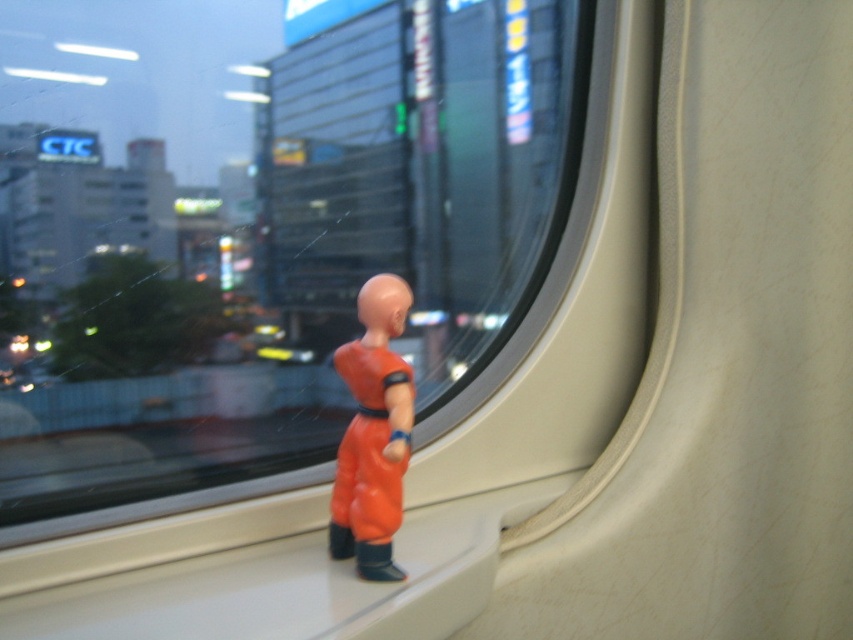
You are standing on the train and want to look through the window. Which of the two points, point (360, 96) or point (379, 577), is closer to your eyes?

Point (360, 96) is further to the viewer than point (379, 577), so the point closer to your eyes is point (379, 577).

You are a passenger on the train and you want to see the city lights outside through the transparent plastic train window at center. Can you see the orange matte figure at center blocking your view?

The transparent plastic train window at center is positioned over the orange matte figure at center, so the figure is blocking part of the window, making it harder to see the city lights outside through that area.

You are a passenger on the train and want to take a photo of the city outside through the transparent plastic train window at center. However, the orange matte figure at center is blocking your view. Can you estimate whether the window is wide enough for you to move the figure to one side and still have space to frame the cityscape without the figure blocking it?

The transparent plastic train window at center might be wider than orange matte figure at center, so there could be enough space to move the figure aside and frame the cityscape without obstruction. However, since the exact width difference isn not specified, it requires checking the actual dimensions.